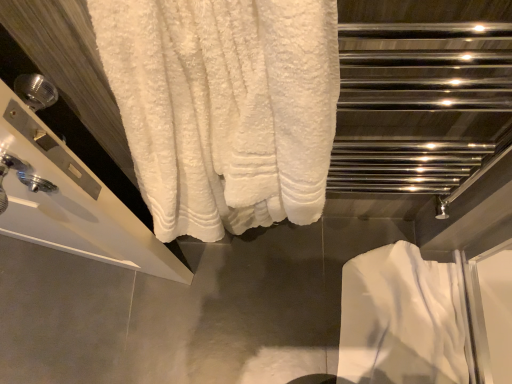
Describe the element at coordinates (401, 319) in the screenshot. This screenshot has height=384, width=512. I see `white soft towel at lower right` at that location.

What is the approximate height of white soft towel at lower right?

The height of white soft towel at lower right is 5.54 centimeters.

The image size is (512, 384). Find the location of `white soft towel at lower right`. white soft towel at lower right is located at coordinates (401, 319).

This screenshot has height=384, width=512. What do you see at coordinates (224, 107) in the screenshot?
I see `white fluffy towel at upper left` at bounding box center [224, 107].

Locate an element on the screen. This screenshot has width=512, height=384. white fluffy towel at upper left is located at coordinates pyautogui.click(x=224, y=107).

The height and width of the screenshot is (384, 512). I want to click on white soft towel at lower right, so click(401, 319).

Which object is positioned more to the left, white soft towel at lower right or white fluffy towel at upper left?

From the viewer's perspective, white fluffy towel at upper left appears more on the left side.

Is white soft towel at lower right positioned before white fluffy towel at upper left?

No, white soft towel at lower right is further to the viewer.

Which is farther, (370, 305) or (115, 25)?

The point (370, 305) is farther.

From the image's perspective, is white soft towel at lower right under white fluffy towel at upper left?

Correct, white soft towel at lower right appears lower than white fluffy towel at upper left in the image.

From a real-world perspective, is white soft towel at lower right located higher than white fluffy towel at upper left?

No, from a real-world perspective, white soft towel at lower right is not on top of white fluffy towel at upper left.

Between white soft towel at lower right and white fluffy towel at upper left, which one has larger width?

With larger width is white soft towel at lower right.

Is white soft towel at lower right taller or shorter than white fluffy towel at upper left?

Clearly, white soft towel at lower right is shorter compared to white fluffy towel at upper left.

Does white soft towel at lower right have a larger size compared to white fluffy towel at upper left?

Actually, white soft towel at lower right might be smaller than white fluffy towel at upper left.

Would you say white soft towel at lower right is outside white fluffy towel at upper left?

white soft towel at lower right lies outside white fluffy towel at upper left's area.

Can you see white soft towel at lower right touching white fluffy towel at upper left?

white soft towel at lower right is not next to white fluffy towel at upper left, and they're not touching.

Is white soft towel at lower right oriented towards white fluffy towel at upper left?

No, white soft towel at lower right is not turned towards white fluffy towel at upper left.

From the picture: How many degrees apart are the facing directions of white soft towel at lower right and white fluffy towel at upper left?

The angle between the facing direction of white soft towel at lower right and the facing direction of white fluffy towel at upper left is 91.3 degrees.

At what (x,y) coordinates should I click in order to perform the action: click on bath towel below the white fluffy towel at upper left (from the image's perspective). Please return your answer as a coordinate pair (x, y). This screenshot has width=512, height=384. Looking at the image, I should click on (401, 319).

Considering the positions of objects white fluffy towel at upper left and white soft towel at lower right in the image provided, who is more to the left, white fluffy towel at upper left or white soft towel at lower right?

white fluffy towel at upper left.

Considering their positions, is white fluffy towel at upper left located in front of or behind white soft towel at lower right?

white fluffy towel at upper left is in front of white soft towel at lower right.

Is point (217, 130) closer to camera compared to point (347, 355)?

Yes, point (217, 130) is in front of point (347, 355).

From the image's perspective, is white fluffy towel at upper left below white soft towel at lower right?

No, from the image's perspective, white fluffy towel at upper left is not below white soft towel at lower right.

From a real-world perspective, which is physically above, white fluffy towel at upper left or white soft towel at lower right?

white fluffy towel at upper left.

Which of these two, white fluffy towel at upper left or white soft towel at lower right, is wider?

white soft towel at lower right.

Considering the sizes of objects white fluffy towel at upper left and white soft towel at lower right in the image provided, who is shorter, white fluffy towel at upper left or white soft towel at lower right?

white soft towel at lower right.

Is white fluffy towel at upper left smaller than white soft towel at lower right?

No, white fluffy towel at upper left is not smaller than white soft towel at lower right.

Is white fluffy towel at upper left inside the boundaries of white soft towel at lower right, or outside?

The correct answer is: outside.

Is white fluffy towel at upper left far away from white soft towel at lower right?

That's not correct — white fluffy towel at upper left is a little close to white soft towel at lower right.

Is white fluffy towel at upper left facing away from white soft towel at lower right?

No.

Consider the image. How different are the orientations of white fluffy towel at upper left and white soft towel at lower right in degrees?

91.3 degrees separate the facing orientations of white fluffy towel at upper left and white soft towel at lower right.

Identify the location of towel that is above the white soft towel at lower right (from the image's perspective). Image resolution: width=512 pixels, height=384 pixels. (224, 107).

Find the location of a particular element. This screenshot has width=512, height=384. bath towel located on the right of white fluffy towel at upper left is located at coordinates (401, 319).

Where is `towel above the white soft towel at lower right (from a real-world perspective)`? The height and width of the screenshot is (384, 512). towel above the white soft towel at lower right (from a real-world perspective) is located at coordinates (224, 107).